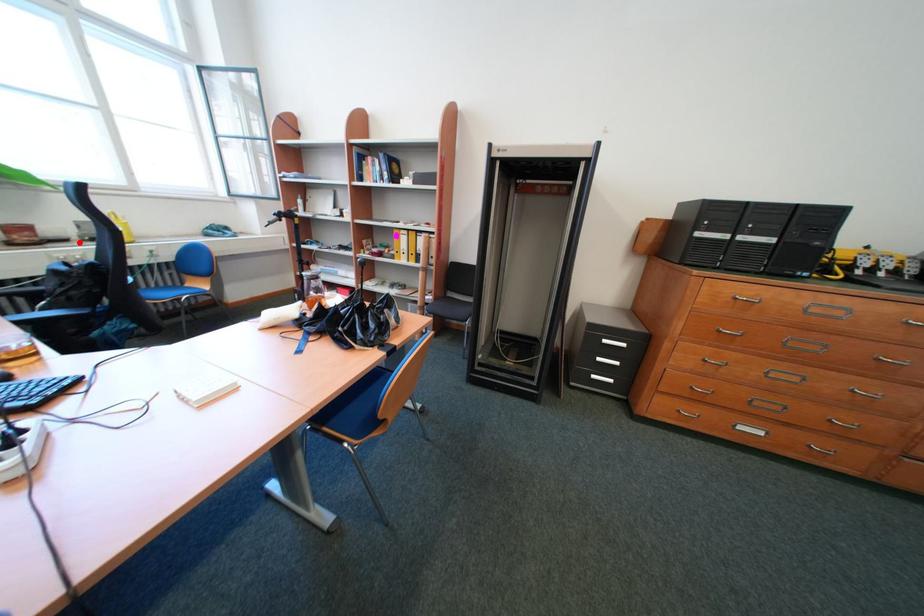
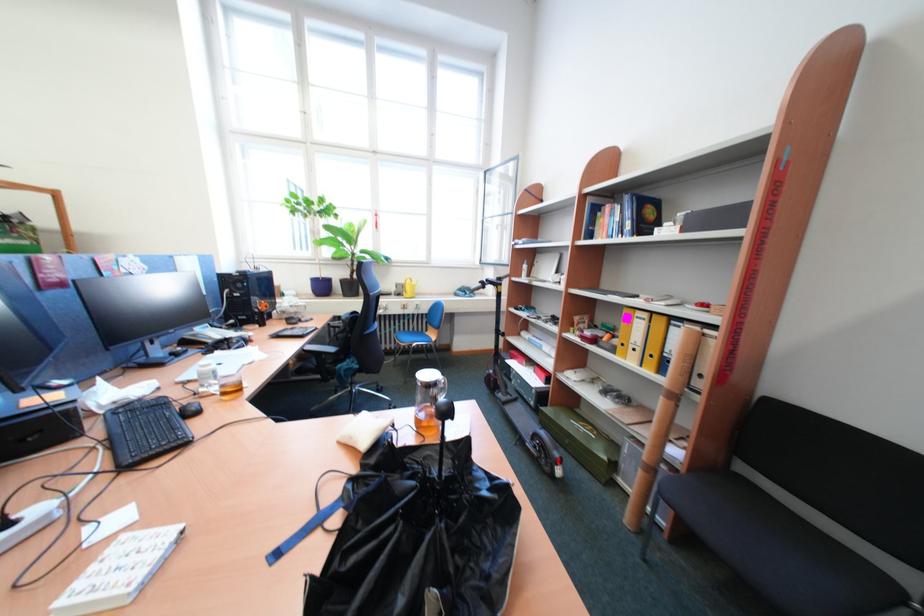
The point at the highlighted location is marked in the first image. Where is the corresponding point in the second image?

(403, 296)